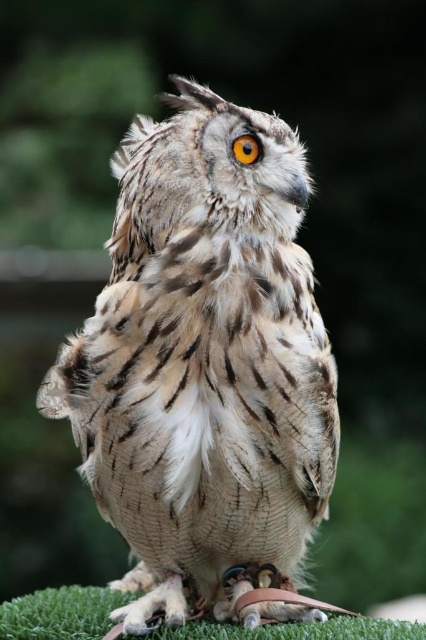
Who is more forward, (129, 433) or (249, 157)?

Point (129, 433) is more forward.

Image resolution: width=426 pixels, height=640 pixels. What do you see at coordinates (203, 360) in the screenshot? I see `brown feathered owl at center` at bounding box center [203, 360].

At what (x,y) coordinates should I click in order to perform the action: click on brown feathered owl at center. Please return your answer as a coordinate pair (x, y). The height and width of the screenshot is (640, 426). Looking at the image, I should click on (203, 360).

Is brown feathered owl at center below green artificial turf at lower center?

No.

Can you confirm if brown feathered owl at center is bigger than green artificial turf at lower center?

Yes, brown feathered owl at center is bigger than green artificial turf at lower center.

Is point (138, 147) positioned before point (5, 627)?

No, (138, 147) is behind (5, 627).

Locate an element on the screen. brown feathered owl at center is located at coordinates (203, 360).

Which is more to the right, green artificial turf at lower center or orange fur eye at center?

orange fur eye at center is more to the right.

Is green artificial turf at lower center below orange fur eye at center?

Yes, green artificial turf at lower center is below orange fur eye at center.

Find the location of a particular element. Image resolution: width=426 pixels, height=640 pixels. green artificial turf at lower center is located at coordinates (58, 612).